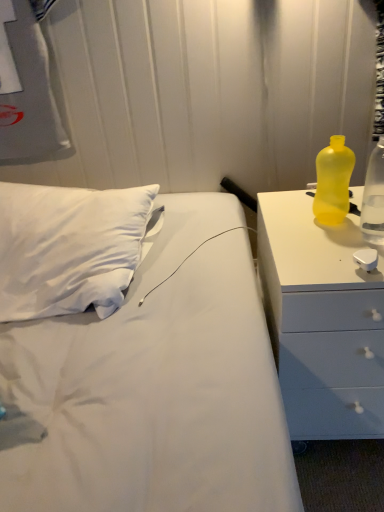
Question: Would you say yellow translucent bottle at right, the 2th bottle viewed from the left, is part of yellow plastic bottle at right's contents?

Choices:
 (A) yes
 (B) no

Answer: (B)

Question: Does yellow plastic bottle at right have a larger size compared to yellow translucent bottle at right, the 2th bottle viewed from the left?

Choices:
 (A) no
 (B) yes

Answer: (B)

Question: From the image's perspective, is yellow plastic bottle at right over yellow translucent bottle at right, the 2th bottle viewed from the left?

Choices:
 (A) no
 (B) yes

Answer: (A)

Question: Is yellow plastic bottle at right at the left side of yellow translucent bottle at right, the first bottle positioned from the right?

Choices:
 (A) no
 (B) yes

Answer: (B)

Question: Considering the relative sizes of yellow plastic bottle at right and yellow translucent bottle at right, the 2th bottle viewed from the left, in the image provided, is yellow plastic bottle at right wider than yellow translucent bottle at right, the 2th bottle viewed from the left,?

Choices:
 (A) yes
 (B) no

Answer: (A)

Question: From the image's perspective, is yellow plastic bottle at right above or below yellow translucent bottle at right, the first bottle positioned from the right?

Choices:
 (A) below
 (B) above

Answer: (A)

Question: In the image, is yellow plastic bottle at right positioned in front of or behind yellow translucent bottle at right, the first bottle positioned from the right?

Choices:
 (A) behind
 (B) front

Answer: (B)

Question: Considering the positions of yellow plastic bottle at right and yellow translucent bottle at right, the first bottle positioned from the right, in the image, is yellow plastic bottle at right wider or thinner than yellow translucent bottle at right, the first bottle positioned from the right,?

Choices:
 (A) thin
 (B) wide

Answer: (B)

Question: From a real-world perspective, is yellow plastic bottle at right positioned above or below yellow translucent bottle at right, the first bottle positioned from the right?

Choices:
 (A) above
 (B) below

Answer: (B)

Question: Visually, is yellow translucent bottle at right, positioned as the 2th bottle in right-to-left order, positioned to the left or to the right of yellow translucent bottle at right, the 2th bottle viewed from the left?

Choices:
 (A) left
 (B) right

Answer: (A)

Question: From a real-world perspective, relative to yellow translucent bottle at right, the first bottle positioned from the right, is yellow translucent bottle at right, positioned as the 2th bottle in right-to-left order, vertically above or below?

Choices:
 (A) above
 (B) below

Answer: (B)

Question: Is yellow translucent bottle at right, which ranks as the first bottle in left-to-right order, inside or outside of yellow translucent bottle at right, the 2th bottle viewed from the left?

Choices:
 (A) inside
 (B) outside

Answer: (B)

Question: From the image's perspective, is yellow translucent bottle at right, positioned as the 2th bottle in right-to-left order, located above or below yellow translucent bottle at right, the 2th bottle viewed from the left?

Choices:
 (A) above
 (B) below

Answer: (A)

Question: Is yellow translucent bottle at right, the first bottle positioned from the right, situated inside yellow plastic bottle at right or outside?

Choices:
 (A) inside
 (B) outside

Answer: (B)

Question: From the image's perspective, is yellow translucent bottle at right, the first bottle positioned from the right, above or below yellow plastic bottle at right?

Choices:
 (A) above
 (B) below

Answer: (A)